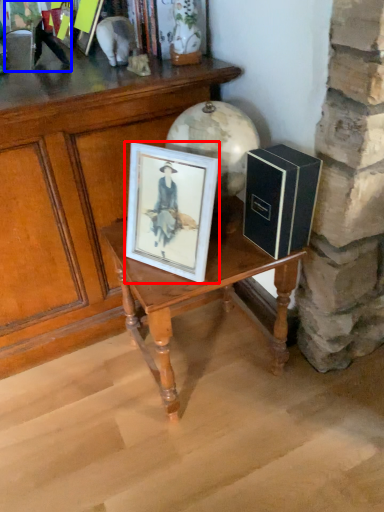
Question: Which point is further to the camera, picture frame (highlighted by a red box) or couple (highlighted by a blue box)?

Choices:
 (A) picture frame
 (B) couple

Answer: (B)